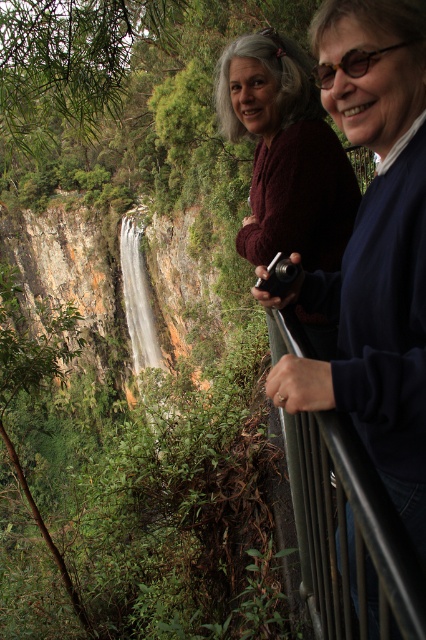
From the picture: You are standing at the viewpoint and want to take a photo of the waterfall. The camera you are using has a focal length of 50mm and an aperture of f8. The recommended distance for optimal focus is 6 meters. Is the point at coordinates point (270, 164) within the acceptable focus range for this setup?

The distance of point (270, 164) from camera is 6.12 meters, which is slightly beyond the recommended 6 meters for optimal focus. However, since the difference is minimal, the point should still be within the acceptable focus range for a 50mm lens at f8 aperture.